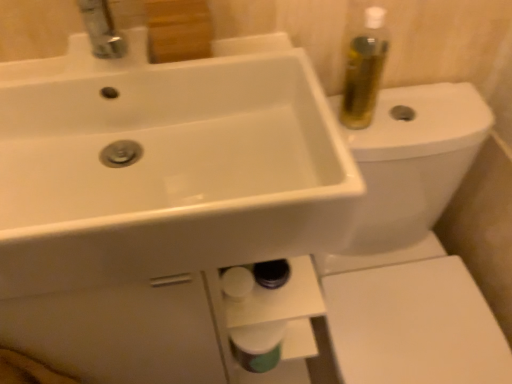
Question: Does white glossy toilet at upper right contain white glossy sink at upper left?

Choices:
 (A) yes
 (B) no

Answer: (B)

Question: From the image's perspective, is white glossy toilet at upper right located beneath white glossy sink at upper left?

Choices:
 (A) no
 (B) yes

Answer: (B)

Question: Considering the relative sizes of white glossy toilet at upper right and white glossy sink at upper left in the image provided, is white glossy toilet at upper right taller than white glossy sink at upper left?

Choices:
 (A) yes
 (B) no

Answer: (A)

Question: Is white glossy toilet at upper right further to camera compared to white glossy sink at upper left?

Choices:
 (A) yes
 (B) no

Answer: (A)

Question: Considering the relative positions of white glossy toilet at upper right and white glossy sink at upper left in the image provided, is white glossy toilet at upper right to the left of white glossy sink at upper left from the viewer's perspective?

Choices:
 (A) yes
 (B) no

Answer: (B)

Question: Is white glossy sink at upper left bigger or smaller than white glossy toilet paper at lower center?

Choices:
 (A) big
 (B) small

Answer: (A)

Question: From the image's perspective, relative to white glossy toilet paper at lower center, is white glossy sink at upper left above or below?

Choices:
 (A) above
 (B) below

Answer: (A)

Question: Based on their positions, is white glossy sink at upper left located to the left or right of white glossy toilet paper at lower center?

Choices:
 (A) right
 (B) left

Answer: (B)

Question: Do you think white glossy sink at upper left is within white glossy toilet paper at lower center, or outside of it?

Choices:
 (A) outside
 (B) inside

Answer: (A)

Question: Is point (254, 332) closer or farther from the camera than point (132, 69)?

Choices:
 (A) farther
 (B) closer

Answer: (A)

Question: Is white glossy toilet paper at lower center inside or outside of white glossy sink at upper left?

Choices:
 (A) inside
 (B) outside

Answer: (B)

Question: In the image, is white glossy toilet paper at lower center positioned in front of or behind white glossy sink at upper left?

Choices:
 (A) front
 (B) behind

Answer: (B)

Question: From the image's perspective, is white glossy toilet paper at lower center positioned above or below white glossy sink at upper left?

Choices:
 (A) below
 (B) above

Answer: (A)

Question: Based on their sizes in the image, would you say white glossy toilet at upper right is bigger or smaller than white glossy toilet paper at lower center?

Choices:
 (A) small
 (B) big

Answer: (B)

Question: Is white glossy toilet at upper right inside the boundaries of white glossy toilet paper at lower center, or outside?

Choices:
 (A) inside
 (B) outside

Answer: (B)